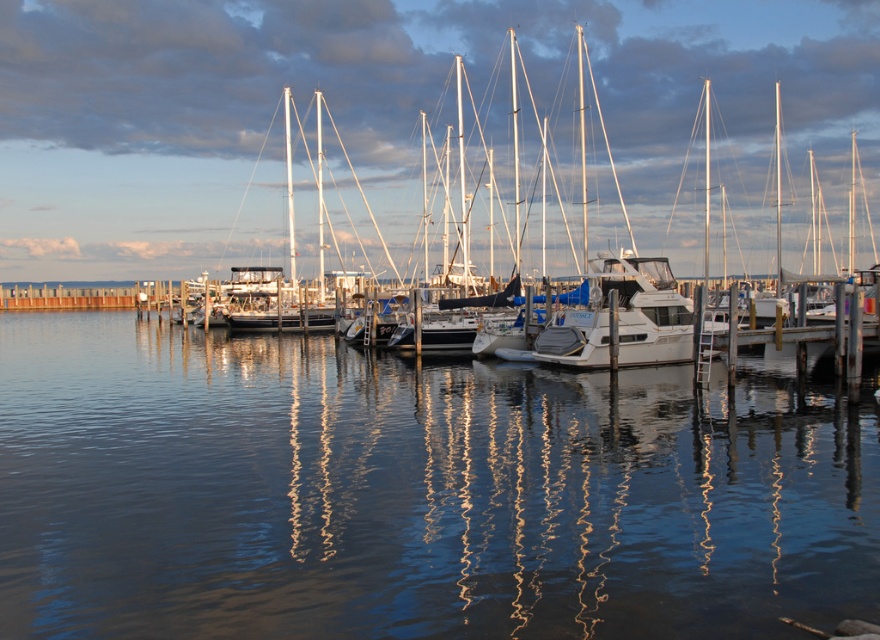
You are standing on the dock and see the white glossy sailboat at center and the white glossy boat at center. Which one is closer to you?

The white glossy sailboat at center is closer to you because it is further to the viewer than the white glossy boat at center.

You are standing on the dock and see the clear water at center and the white glossy sailboat at center. Which object is closer to you?

The clear water at center is closer to you because it is in front of the white glossy sailboat at center.

You are a dock worker who needs to ensure that both the white glossy sailboat at center and the white glossy boat at center can fit side by side on a dock that is 10 meters wide. Given their widths, will they fit comfortably without overlapping?

The white glossy sailboat at center is wider than the white glossy boat at center. However, without knowing their exact widths, it is impossible to determine if their combined width is less than or equal to 10 meters. More information is needed to confirm if they can fit comfortably without overlapping.